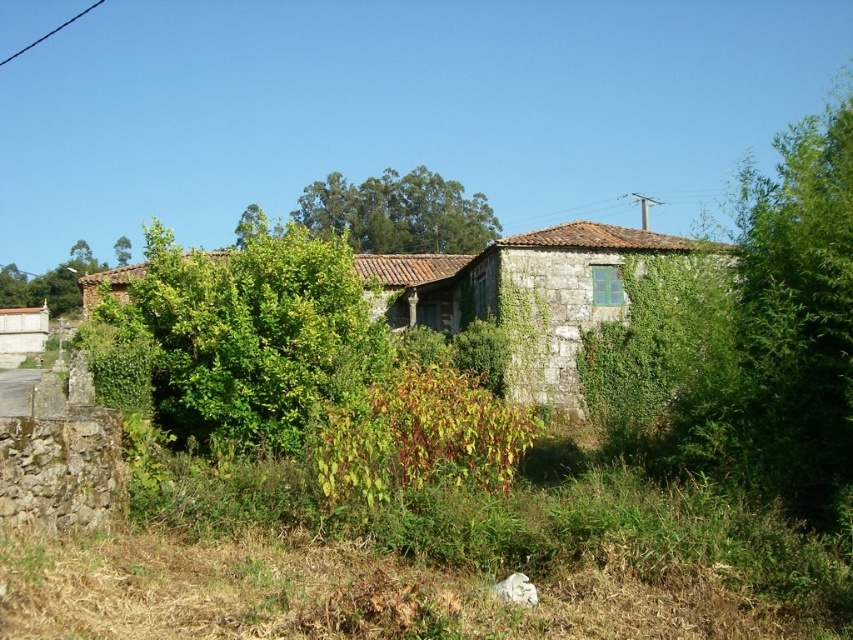
Question: Can you confirm if green leafy bush at center is positioned above green leafy plant at center?

Choices:
 (A) no
 (B) yes

Answer: (B)

Question: Is white concrete shed at lower left smaller than green leafy tree at upper left?

Choices:
 (A) no
 (B) yes

Answer: (B)

Question: Can you confirm if green leafy plant at center is thinner than green leafy tree at upper left?

Choices:
 (A) no
 (B) yes

Answer: (B)

Question: Among these points, which one is farthest from the camera?

Choices:
 (A) (114, 253)
 (B) (434, 392)
 (C) (283, 260)

Answer: (A)

Question: Among these objects, which one is farthest from the camera?

Choices:
 (A) green leafy tree at upper left
 (B) green leafy bush at center

Answer: (A)

Question: Estimate the real-world distances between objects in this image. Which object is farther from the green leafy bush at center?

Choices:
 (A) green leafy tree at upper left
 (B) white concrete shed at lower left
 (C) green leafy tree at upper center

Answer: (B)